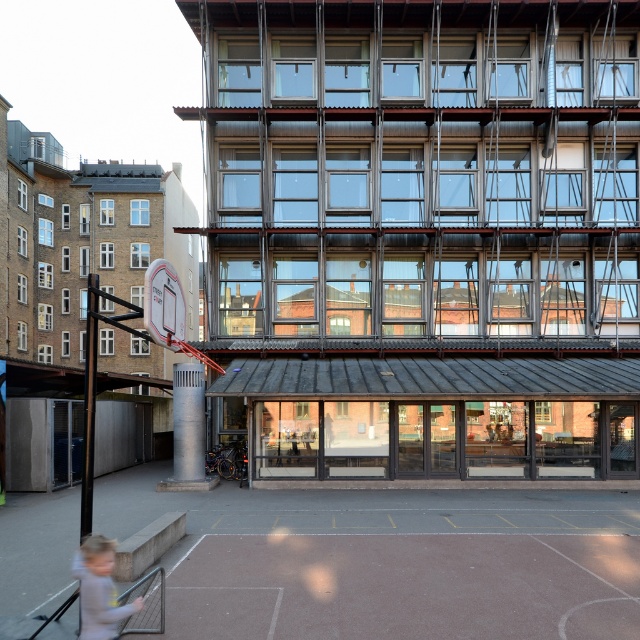
Question: Which object is closer to the camera taking this photo?

Choices:
 (A) white plastic basketball hoop at left
 (B) light gray fabric at lower left
 (C) metallic silver basketball hoop at center

Answer: (B)

Question: Which of the following is the farthest from the observer?

Choices:
 (A) metallic silver basketball hoop at center
 (B) white plastic basketball hoop at left
 (C) light gray fabric at lower left

Answer: (A)

Question: Is light gray fabric at lower left behind metallic silver basketball hoop at center?

Choices:
 (A) no
 (B) yes

Answer: (A)

Question: Estimate the real-world distances between objects in this image. Which object is closer to the metallic silver basketball hoop at center?

Choices:
 (A) light gray fabric at lower left
 (B) white plastic basketball hoop at left

Answer: (B)

Question: Can you confirm if light gray fabric at lower left is positioned above metallic silver basketball hoop at center?

Choices:
 (A) no
 (B) yes

Answer: (A)

Question: Is the position of light gray fabric at lower left more distant than that of white plastic basketball hoop at left?

Choices:
 (A) no
 (B) yes

Answer: (A)